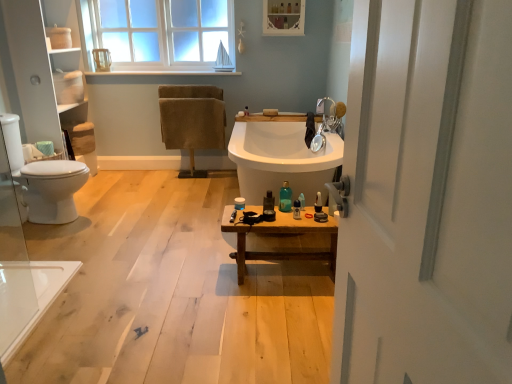
What is the approximate width of matte white container at center, which is the sixth toiletry in right-to-left order?

The width of matte white container at center, which is the sixth toiletry in right-to-left order, is 2.95 inches.

What do you see at coordinates (268, 204) in the screenshot?
I see `translucent plastic bottle at center, which is the second toiletry from left to right` at bounding box center [268, 204].

What do you see at coordinates (302, 200) in the screenshot?
I see `translucent plastic tube at center, acting as the 2th toiletry starting from the right` at bounding box center [302, 200].

This screenshot has width=512, height=384. What do you see at coordinates (31, 153) in the screenshot?
I see `white matte toilet paper at left` at bounding box center [31, 153].

Locate an element on the screen. Image resolution: width=512 pixels, height=384 pixels. white glass window at upper center is located at coordinates (x=157, y=33).

Where is `wooden bench at center`? The width and height of the screenshot is (512, 384). wooden bench at center is located at coordinates (281, 237).

From a real-world perspective, is matte black razor at center, placed as the 1th toiletry when sorted from right to left, under translucent plastic tube at center, acting as the 2th toiletry starting from the right?

No, from a real-world perspective, matte black razor at center, placed as the 1th toiletry when sorted from right to left, is not beneath translucent plastic tube at center, acting as the 2th toiletry starting from the right.

Can you confirm if matte black razor at center, marked as the sixth toiletry in a left-to-right arrangement, is bigger than translucent plastic tube at center, the fifth toiletry viewed from the left?

Yes, matte black razor at center, marked as the sixth toiletry in a left-to-right arrangement, is bigger than translucent plastic tube at center, the fifth toiletry viewed from the left.

Between matte black razor at center, placed as the 1th toiletry when sorted from right to left, and translucent plastic tube at center, the fifth toiletry viewed from the left, which one is positioned behind?

Positioned behind is translucent plastic tube at center, the fifth toiletry viewed from the left.

Considering the relative sizes of matte black razor at center, placed as the 1th toiletry when sorted from right to left, and translucent plastic tube at center, acting as the 2th toiletry starting from the right, in the image provided, is matte black razor at center, placed as the 1th toiletry when sorted from right to left, wider than translucent plastic tube at center, acting as the 2th toiletry starting from the right,?

Indeed, matte black razor at center, placed as the 1th toiletry when sorted from right to left, has a greater width compared to translucent plastic tube at center, acting as the 2th toiletry starting from the right.

Does silver metallic faucet at upper center turn towards translucent plastic tube at center, the fifth toiletry viewed from the left?

No.

Considering the relative sizes of silver metallic faucet at upper center and translucent plastic tube at center, the fifth toiletry viewed from the left, in the image provided, is silver metallic faucet at upper center thinner than translucent plastic tube at center, the fifth toiletry viewed from the left,?

No.

How many degrees apart are the facing directions of silver metallic faucet at upper center and translucent plastic tube at center, acting as the 2th toiletry starting from the right?

silver metallic faucet at upper center and translucent plastic tube at center, acting as the 2th toiletry starting from the right, are facing 3.27 degrees away from each other.

Is silver metallic faucet at upper center in contact with translucent plastic tube at center, acting as the 2th toiletry starting from the right?

silver metallic faucet at upper center and translucent plastic tube at center, acting as the 2th toiletry starting from the right, are clearly separated.

Can you confirm if wooden bench at center is shorter than translucent plastic bottle at center, which is the second toiletry from left to right?

In fact, wooden bench at center may be taller than translucent plastic bottle at center, which is the second toiletry from left to right.

Between wooden bench at center and translucent plastic bottle at center, which is the second toiletry from left to right, which one is positioned behind?

translucent plastic bottle at center, which is the second toiletry from left to right, is more distant.

From a real-world perspective, which is physically above, wooden bench at center or translucent plastic bottle at center, which is the second toiletry from left to right?

translucent plastic bottle at center, which is the second toiletry from left to right, from a real-world perspective.

Can we say wooden bench at center lies outside translucent plastic bottle at center, which is the second toiletry from left to right?

Yes, wooden bench at center is located beyond the bounds of translucent plastic bottle at center, which is the second toiletry from left to right.

How much distance is there between matte white container at center, which appears as the first toiletry when viewed from the left, and translucent plastic bottle at center, which appears as the fifth toiletry when viewed from the right?

The distance of matte white container at center, which appears as the first toiletry when viewed from the left, from translucent plastic bottle at center, which appears as the fifth toiletry when viewed from the right, is 19.35 centimeters.

Is matte white container at center, which appears as the first toiletry when viewed from the left, not inside translucent plastic bottle at center, which appears as the fifth toiletry when viewed from the right?

Yes, matte white container at center, which appears as the first toiletry when viewed from the left, is outside of translucent plastic bottle at center, which appears as the fifth toiletry when viewed from the right.

Considering the relative sizes of matte white container at center, which is the sixth toiletry in right-to-left order, and translucent plastic bottle at center, which is the second toiletry from left to right, in the image provided, is matte white container at center, which is the sixth toiletry in right-to-left order, shorter than translucent plastic bottle at center, which is the second toiletry from left to right,?

Yes.

Is point (239, 205) more distant than point (264, 210)?

Yes, point (239, 205) is farther from viewer.

Choose the correct answer: Is matte white container at center, which is the sixth toiletry in right-to-left order, inside translucent plastic bottle at center, which appears as the third toiletry when viewed from the right, or outside it?

matte white container at center, which is the sixth toiletry in right-to-left order, lies outside translucent plastic bottle at center, which appears as the third toiletry when viewed from the right.

Is point (241, 207) closer or farther from the camera than point (298, 218)?

Point (241, 207).

Considering their positions, is matte white container at center, which appears as the first toiletry when viewed from the left, located in front of or behind translucent plastic bottle at center, marked as the 4th toiletry in a left-to-right arrangement?

matte white container at center, which appears as the first toiletry when viewed from the left, is behind translucent plastic bottle at center, marked as the 4th toiletry in a left-to-right arrangement.

Can you confirm if matte white container at center, which is the sixth toiletry in right-to-left order, is positioned to the left of translucent plastic bottle at center, marked as the 4th toiletry in a left-to-right arrangement?

Correct, you'll find matte white container at center, which is the sixth toiletry in right-to-left order, to the left of translucent plastic bottle at center, marked as the 4th toiletry in a left-to-right arrangement.

Does translucent plastic bottle at center, which appears as the third toiletry when viewed from the right, turn towards silver metallic faucet at upper center?

No, translucent plastic bottle at center, which appears as the third toiletry when viewed from the right, is not aimed at silver metallic faucet at upper center.

Is translucent plastic bottle at center, which appears as the third toiletry when viewed from the right, spatially inside silver metallic faucet at upper center, or outside of it?

translucent plastic bottle at center, which appears as the third toiletry when viewed from the right, is spatially situated outside silver metallic faucet at upper center.

Does translucent plastic bottle at center, marked as the 4th toiletry in a left-to-right arrangement, have a larger size compared to silver metallic faucet at upper center?

Actually, translucent plastic bottle at center, marked as the 4th toiletry in a left-to-right arrangement, might be smaller than silver metallic faucet at upper center.

Are translucent plastic bottle at center, which is the second toiletry from left to right, and silver metallic faucet at upper center located far from each other?

No, translucent plastic bottle at center, which is the second toiletry from left to right, is not far away from silver metallic faucet at upper center.

Would you say translucent plastic bottle at center, which appears as the fifth toiletry when viewed from the right, is outside silver metallic faucet at upper center?

Indeed, translucent plastic bottle at center, which appears as the fifth toiletry when viewed from the right, is completely outside silver metallic faucet at upper center.

Does translucent plastic bottle at center, which is the second toiletry from left to right, turn towards silver metallic faucet at upper center?

No.

From the image's perspective, which is below, translucent plastic bottle at center, which appears as the fifth toiletry when viewed from the right, or silver metallic faucet at upper center?

translucent plastic bottle at center, which appears as the fifth toiletry when viewed from the right, appears lower in the image.

From the translucent plastic tube at center, acting as the 2th toiletry starting from the right, count 1st toiletrys forward and point to it. Please provide its 2D coordinates.

[(318, 203)]

Where is `tap located behind the translucent plastic tube at center, acting as the 2th toiletry starting from the right`? The width and height of the screenshot is (512, 384). tap located behind the translucent plastic tube at center, acting as the 2th toiletry starting from the right is located at coordinates click(327, 123).

Considering their positions, is matte black razor at center, marked as the sixth toiletry in a left-to-right arrangement, positioned further to white glass window at upper center than matte white medicine cabinet at upper center?

Based on the image, matte black razor at center, marked as the sixth toiletry in a left-to-right arrangement, appears to be further to white glass window at upper center.

When comparing their distances from white glass window at upper center, does translucent plastic tube at center, acting as the 2th toiletry starting from the right, or white matte toilet paper at left seem closer?

Based on the image, white matte toilet paper at left appears to be nearer to white glass window at upper center.

Considering their positions, is translucent plastic tube at center, acting as the 2th toiletry starting from the right, positioned closer to matte black razor at center, placed as the 1th toiletry when sorted from right to left, than matte white container at center, which appears as the first toiletry when viewed from the left?

translucent plastic tube at center, acting as the 2th toiletry starting from the right, is closer to matte black razor at center, placed as the 1th toiletry when sorted from right to left.

From the picture: When comparing their distances from white glass window at upper center, does matte white container at center, which is the sixth toiletry in right-to-left order, or white matte toilet paper at left seem closer?

white matte toilet paper at left.

From the image, which object appears to be nearer to white matte toilet paper at left, translucent plastic bottle at center, which appears as the fifth toiletry when viewed from the right, or wooden bench at center?

The object closer to white matte toilet paper at left is translucent plastic bottle at center, which appears as the fifth toiletry when viewed from the right.

Estimate the real-world distances between objects in this image. Which object is further from matte black razor at center, placed as the 1th toiletry when sorted from right to left, matte white medicine cabinet at upper center or translucent glass bottle at center, which is the 3th toiletry in left-to-right order?

The object further to matte black razor at center, placed as the 1th toiletry when sorted from right to left, is matte white medicine cabinet at upper center.

Based on their spatial positions, is translucent plastic bottle at center, which is the second toiletry from left to right, or white matte toilet paper at left closer to translucent plastic tube at center, acting as the 2th toiletry starting from the right?

Among the two, translucent plastic bottle at center, which is the second toiletry from left to right, is located nearer to translucent plastic tube at center, acting as the 2th toiletry starting from the right.

Looking at the image, which one is located further to translucent plastic bottle at center, marked as the 4th toiletry in a left-to-right arrangement, matte white container at center, which appears as the first toiletry when viewed from the left, or white glass window at upper center?

Among the two, white glass window at upper center is located further to translucent plastic bottle at center, marked as the 4th toiletry in a left-to-right arrangement.

Locate an element on the screen. toilet between white glass window at upper center and wooden bench at center vertically is located at coordinates [x=42, y=179].

The width and height of the screenshot is (512, 384). I want to click on toilet situated between white matte toilet paper at left and wooden bench at center from left to right, so (42, 179).

I want to click on tap between matte white medicine cabinet at upper center and translucent plastic bottle at center, which appears as the fifth toiletry when viewed from the right, in the up-down direction, so click(x=327, y=123).

Identify the location of medicine cabinet between white matte toilet paper at left and silver metallic faucet at upper center from left to right. (283, 17).